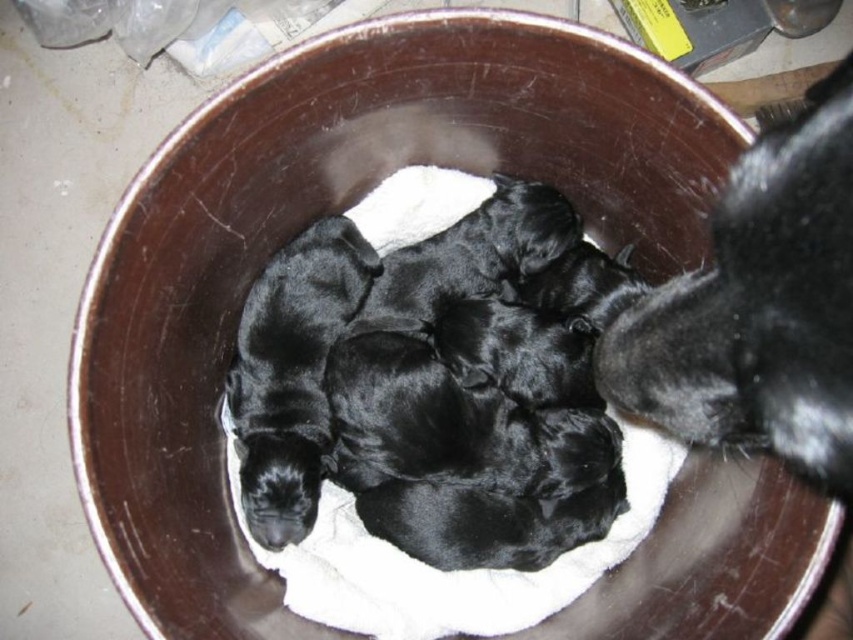
Question: Which point is farther to the camera?

Choices:
 (A) black smooth puppies at center
 (B) black fur at right

Answer: (A)

Question: Where is black smooth puppies at center located in relation to black fur at right in the image?

Choices:
 (A) above
 (B) below

Answer: (B)

Question: Does black smooth puppies at center lie in front of black fur at right?

Choices:
 (A) no
 (B) yes

Answer: (A)

Question: Which object appears closest to the camera in this image?

Choices:
 (A) black fur at right
 (B) black smooth puppies at center

Answer: (A)

Question: Can you confirm if black smooth puppies at center is wider than black fur at right?

Choices:
 (A) yes
 (B) no

Answer: (A)